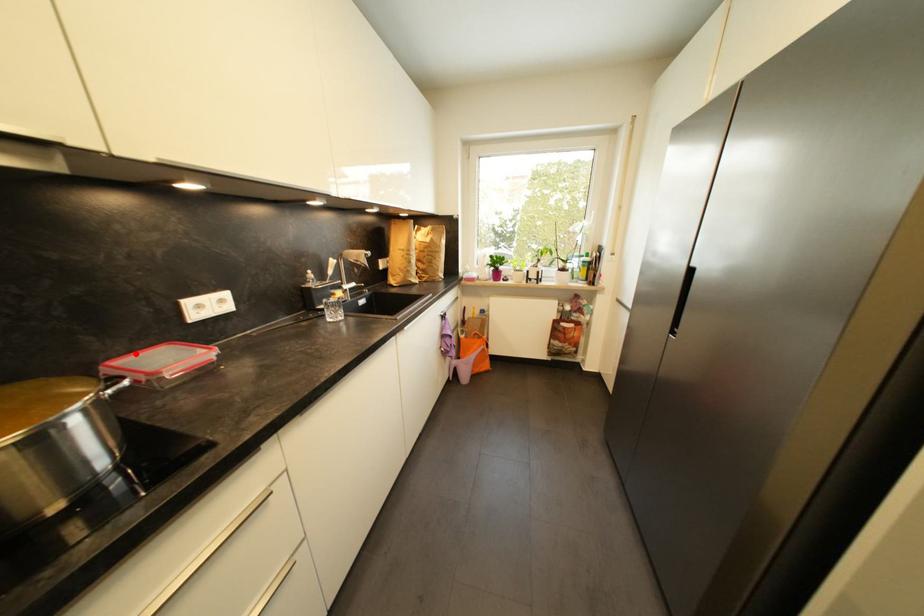
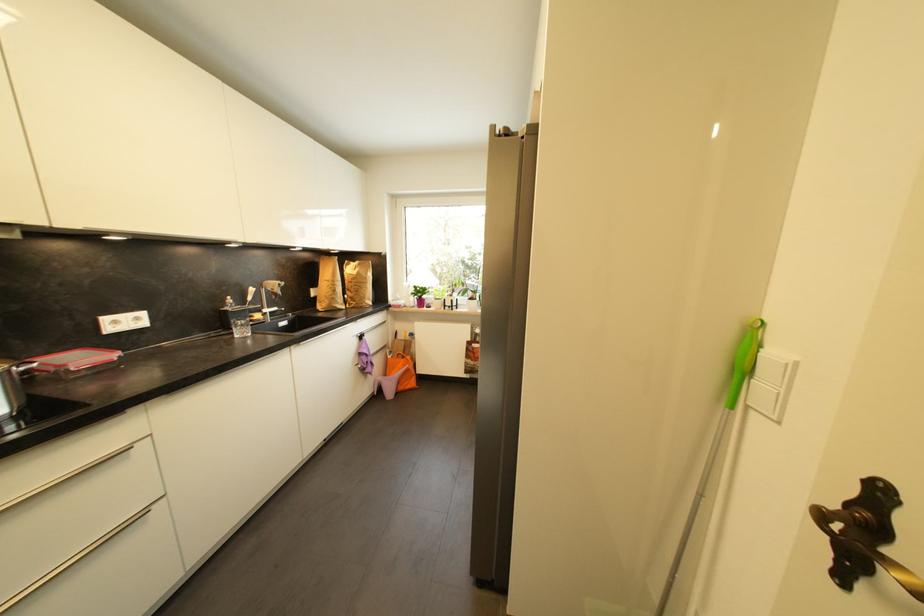
Question: I am providing you with two images of the same scene from different viewpoints. Given a red point in image1, look at the same physical point in image2. Is it:

Choices:
 (A) Closer to the viewpoint
 (B) Farther from the viewpoint

Answer: (B)